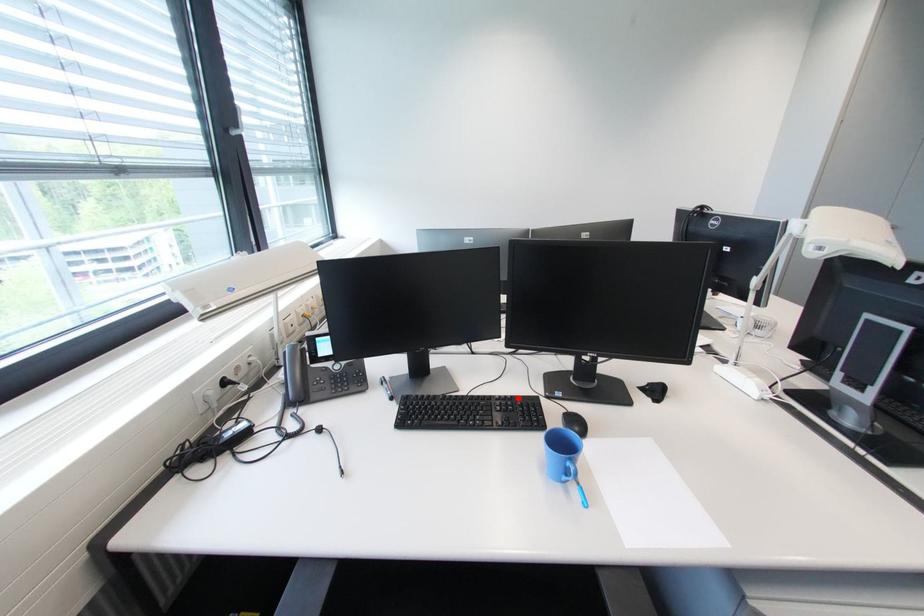
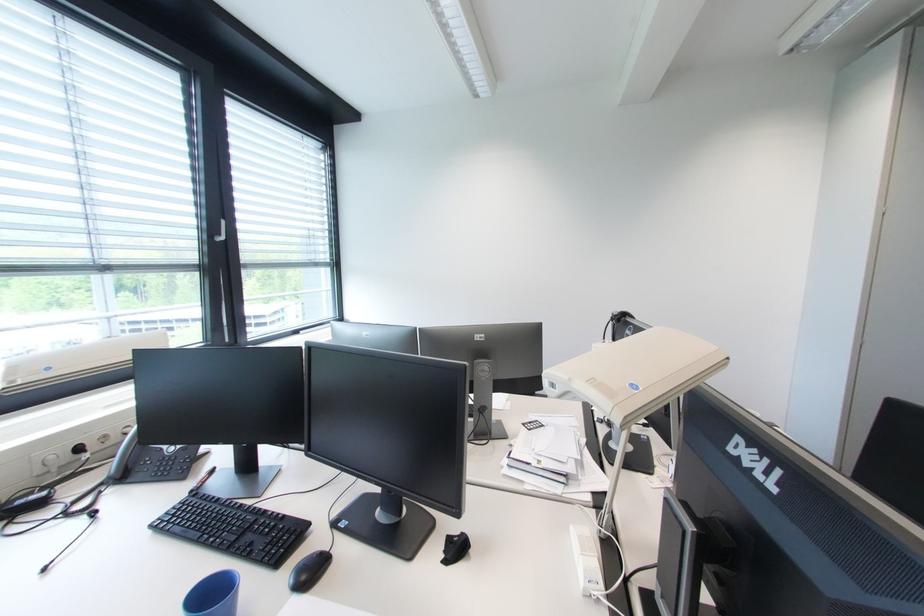
In the second image, find the point that corresponds to the highlighted location in the first image.

(290, 517)